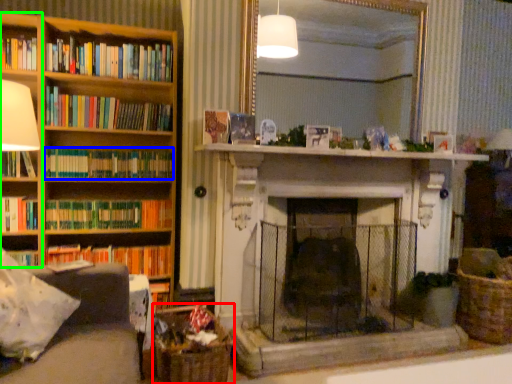
Question: Which object is positioned farthest from basket (highlighted by a red box)? Select from book (highlighted by a blue box) and shelf (highlighted by a green box).

Choices:
 (A) book
 (B) shelf

Answer: (B)